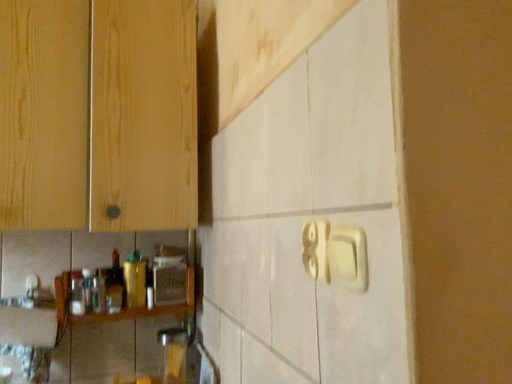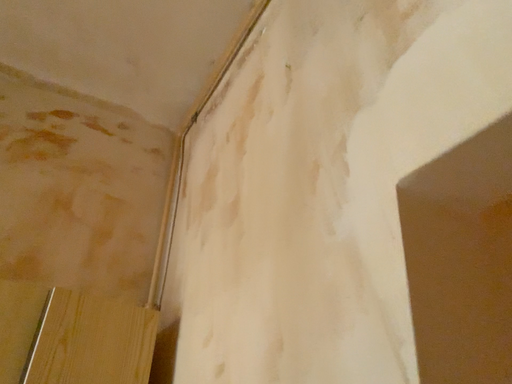
Question: Which way did the camera rotate in the video?

Choices:
 (A) rotated downward
 (B) rotated upward

Answer: (B)